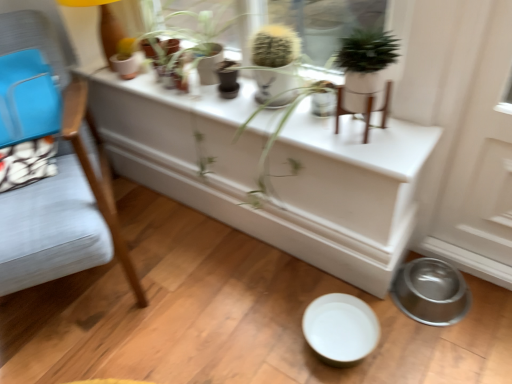
You are a GUI agent. You are given a task and a screenshot of the screen. Output one action in this format:
    pyautogui.click(x=<x>, y=<y>)
    Task: Click on the free location above white glossy table at center (from a real-world perspective)
    
    Given the screenshot: What is the action you would take?
    pyautogui.click(x=230, y=175)